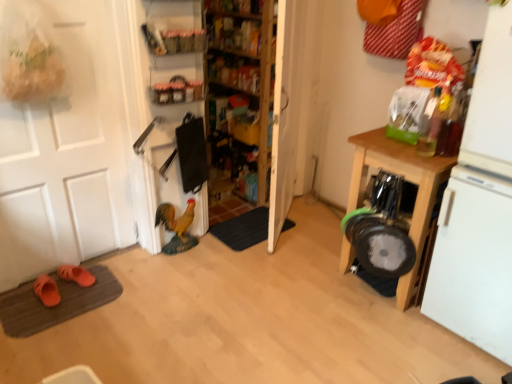
Question: Can you confirm if wooden shelves at center, which is the 1th shelf from back to front, is shorter than orange suede slippers at lower left, the 1th footwear viewed from the back?

Choices:
 (A) yes
 (B) no

Answer: (B)

Question: Is wooden shelves at center, which is the 1th shelf from back to front, positioned behind orange suede slippers at lower left, the 1th footwear viewed from the back?

Choices:
 (A) no
 (B) yes

Answer: (A)

Question: Considering the relative sizes of wooden shelves at center, which is the 1th shelf from back to front, and orange suede slippers at lower left, the 1th footwear viewed from the back, in the image provided, is wooden shelves at center, which is the 1th shelf from back to front, smaller than orange suede slippers at lower left, the 1th footwear viewed from the back,?

Choices:
 (A) yes
 (B) no

Answer: (B)

Question: Does wooden shelves at center, which is the third shelf from front to back, have a lesser width compared to orange suede slippers at lower left, the 1th footwear viewed from the back?

Choices:
 (A) no
 (B) yes

Answer: (B)

Question: From a real-world perspective, does wooden shelves at center, which is the third shelf from front to back, sit lower than orange suede slippers at lower left, which is the 2th footwear from front to back?

Choices:
 (A) no
 (B) yes

Answer: (A)

Question: From the image's perspective, would you say wooden shelves at center, which is the 1th shelf from back to front, is positioned over orange suede slippers at lower left, the 1th footwear viewed from the back?

Choices:
 (A) no
 (B) yes

Answer: (B)

Question: Can we say orange suede slippers at lower left, the 1th footwear viewed from the back, lies outside orange rubber slippers at lower left, positioned as the first footwear in front-to-back order?

Choices:
 (A) no
 (B) yes

Answer: (B)

Question: Does orange suede slippers at lower left, which is the 2th footwear from front to back, appear on the left side of orange rubber slippers at lower left, acting as the 2th footwear starting from the back?

Choices:
 (A) no
 (B) yes

Answer: (A)

Question: Considering the relative positions of orange suede slippers at lower left, which is the 2th footwear from front to back, and orange rubber slippers at lower left, positioned as the first footwear in front-to-back order, in the image provided, is orange suede slippers at lower left, which is the 2th footwear from front to back, behind orange rubber slippers at lower left, positioned as the first footwear in front-to-back order,?

Choices:
 (A) no
 (B) yes

Answer: (B)

Question: Is orange suede slippers at lower left, which is the 2th footwear from front to back, bigger than orange rubber slippers at lower left, positioned as the first footwear in front-to-back order?

Choices:
 (A) yes
 (B) no

Answer: (B)

Question: From a real-world perspective, is orange suede slippers at lower left, which is the 2th footwear from front to back, physically below orange rubber slippers at lower left, acting as the 2th footwear starting from the back?

Choices:
 (A) yes
 (B) no

Answer: (A)

Question: Is orange suede slippers at lower left, which is the 2th footwear from front to back, positioned before orange rubber slippers at lower left, positioned as the first footwear in front-to-back order?

Choices:
 (A) yes
 (B) no

Answer: (B)

Question: From a real-world perspective, is dark gray carpet at center, which is the 2th doormat from left to right, physically below matte plastic shelf at upper center, which ranks as the first shelf in front-to-back order?

Choices:
 (A) no
 (B) yes

Answer: (B)